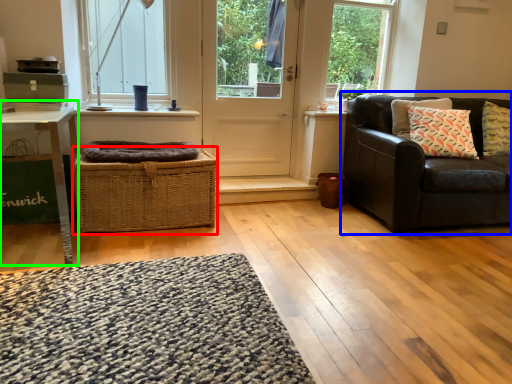
Question: Based on their relative distances, which object is nearer to crate (highlighted by a red box)? Choose from studio couch (highlighted by a blue box) and table (highlighted by a green box).

Choices:
 (A) studio couch
 (B) table

Answer: (B)